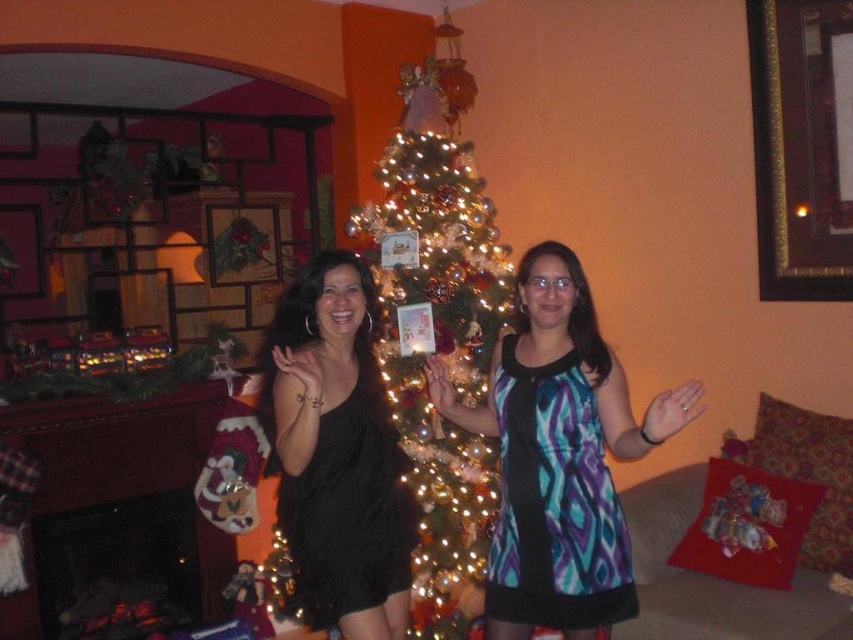
Who is more distant from viewer, (642, 422) or (447, 104)?

The point (447, 104) is more distant.

Does blue and white patterned dress at center have a lesser height compared to iridescent glass christmas tree at center?

Yes, blue and white patterned dress at center is shorter than iridescent glass christmas tree at center.

This screenshot has width=853, height=640. What do you see at coordinates (558, 456) in the screenshot?
I see `blue and white patterned dress at center` at bounding box center [558, 456].

You are a GUI agent. You are given a task and a screenshot of the screen. Output one action in this format:
    pyautogui.click(x=<x>, y=<y>)
    Task: Click on the blue and white patterned dress at center
    This screenshot has height=640, width=853.
    Given the screenshot: What is the action you would take?
    pyautogui.click(x=558, y=456)

Which of these two, blue and white patterned dress at center or black satin dress at center, stands taller?

With more height is black satin dress at center.

Between point (444, 372) and point (392, 458), which one is positioned behind?

Positioned behind is point (444, 372).

Between point (439, 392) and point (341, 595), which one is positioned behind?

The point (439, 392) is behind.

Find the location of a particular element. This screenshot has height=640, width=853. blue and white patterned dress at center is located at coordinates (558, 456).

Between iridescent glass christmas tree at center and black satin dress at center, which one is positioned lower?

Positioned lower is black satin dress at center.

Which is behind, point (386, 269) or point (283, 449)?

The point (386, 269) is behind.

Is point (480, 328) closer to viewer compared to point (312, 278)?

No.

The image size is (853, 640). In order to click on iridescent glass christmas tree at center in this screenshot , I will do `click(440, 326)`.